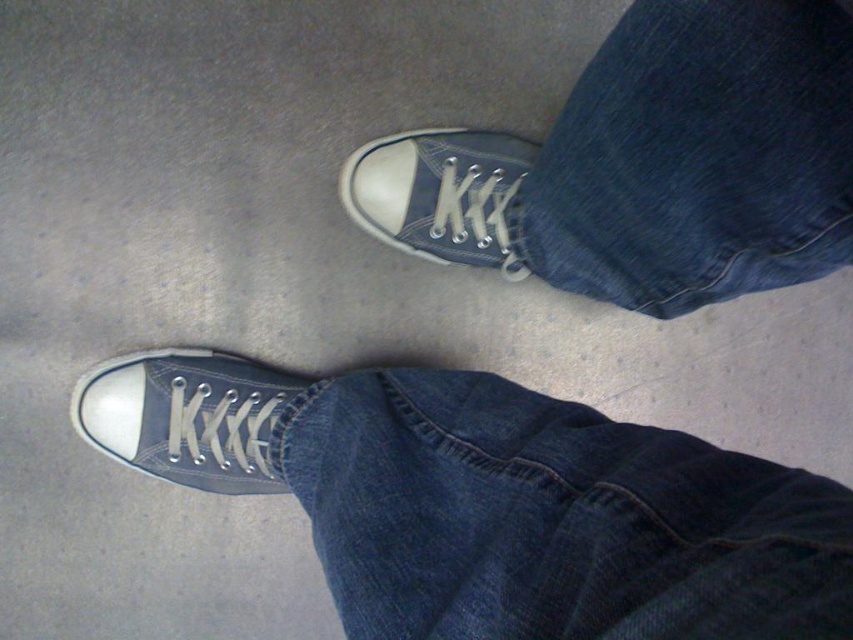
Identify the location of denim at lower center. (553, 518).

Between point (664, 552) and point (109, 394), which one is positioned behind?

Positioned behind is point (109, 394).

The width and height of the screenshot is (853, 640). I want to click on denim at lower center, so click(553, 518).

Is denim at center behind matte canvas sneaker at lower left?

That is False.

Who is more forward, (575, 177) or (210, 451)?

Point (575, 177) is more forward.

Who is more distant from viewer, (570, 268) or (227, 440)?

Positioned behind is point (227, 440).

Identify the location of denim at center. This screenshot has height=640, width=853. click(x=699, y=156).

Does matte canvas sneaker at lower left have a greater height compared to matte canvas shoe at center?

Incorrect, matte canvas sneaker at lower left's height is not larger of matte canvas shoe at center's.

Does matte canvas sneaker at lower left appear under matte canvas shoe at center?

Correct, matte canvas sneaker at lower left is located below matte canvas shoe at center.

What are the coordinates of `matte canvas sneaker at lower left` in the screenshot? It's located at (189, 417).